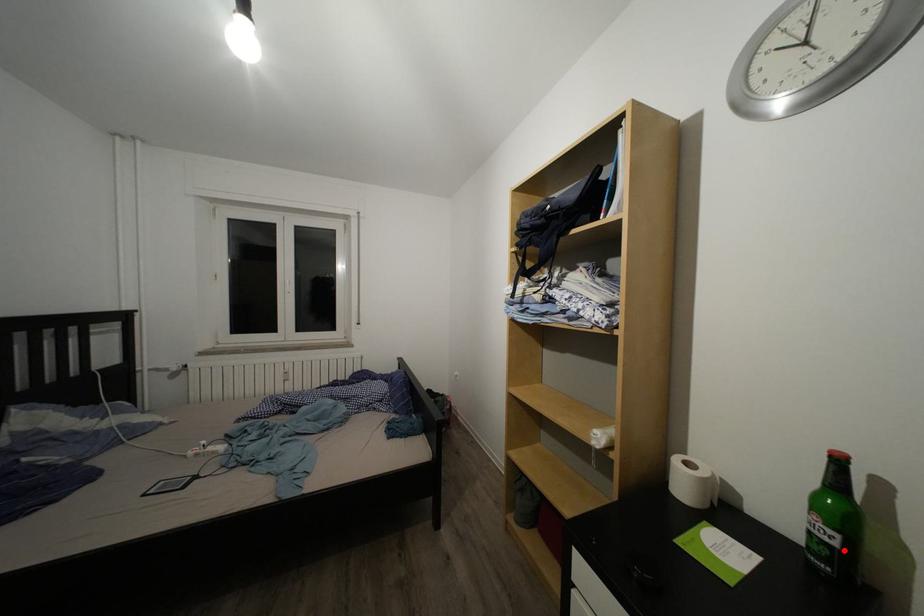
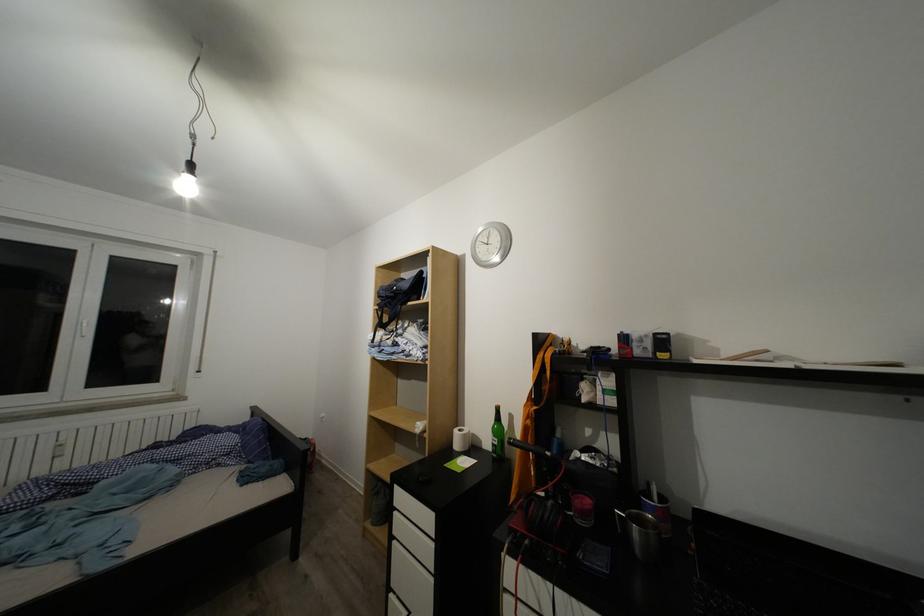
Find the pixel in the second image that matches the highlighted location in the first image.

(504, 450)